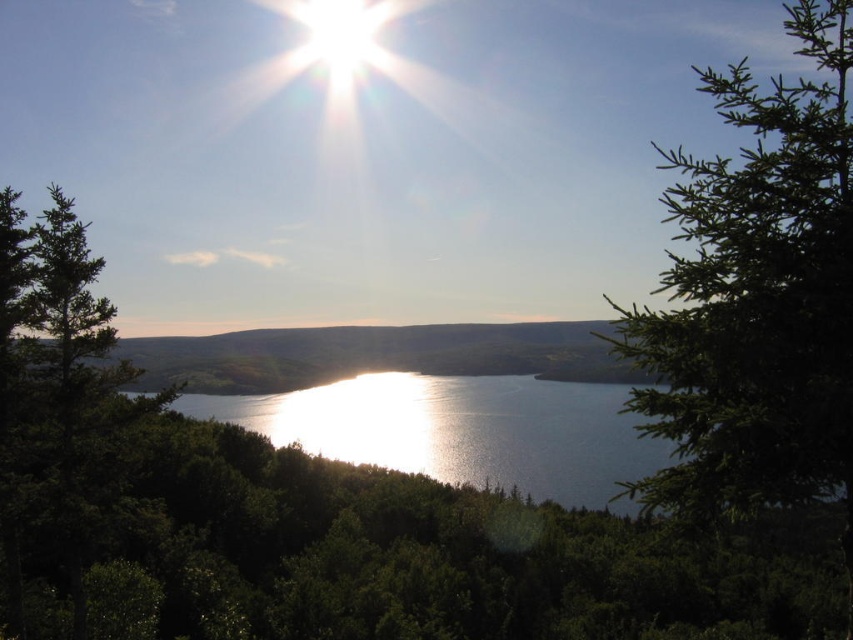
Question: Can you confirm if green needle-like tree at right is wider than shiny reflective water at center?

Choices:
 (A) no
 (B) yes

Answer: (A)

Question: Is green needle-like tree at right below shiny reflective water at center?

Choices:
 (A) no
 (B) yes

Answer: (A)

Question: Which object appears farthest from the camera in this image?

Choices:
 (A) shiny reflective water at center
 (B) green needle-like tree at right

Answer: (A)

Question: Is green needle-like tree at right below shiny reflective water at center?

Choices:
 (A) no
 (B) yes

Answer: (A)